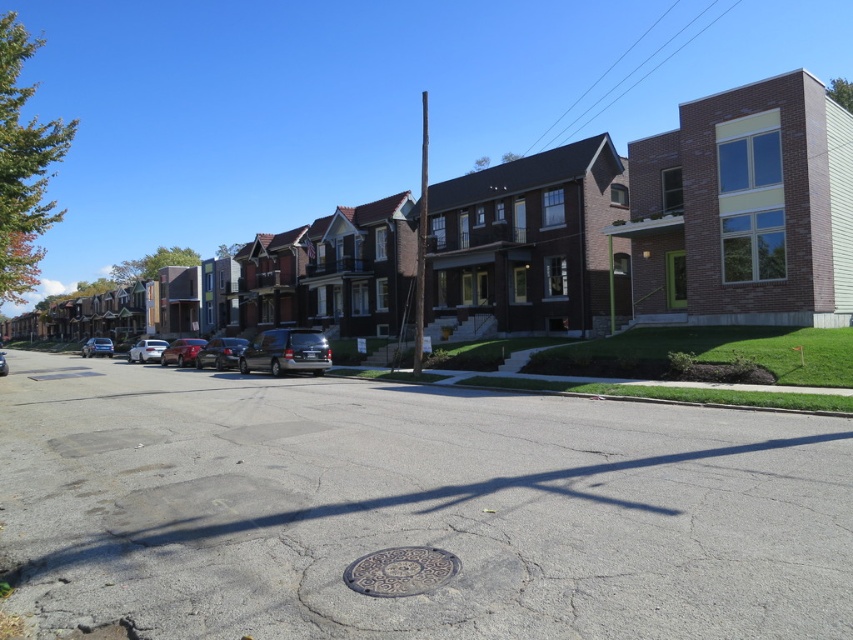
Does gold textured manhole cover at center have a smaller size compared to satin blue sedan at left?

Indeed, gold textured manhole cover at center has a smaller size compared to satin blue sedan at left.

Can you confirm if gold textured manhole cover at center is positioned to the left of satin blue sedan at left?

No, gold textured manhole cover at center is not to the left of satin blue sedan at left.

Is point (442, 554) behind point (106, 342)?

No, it is not.

Where is `gold textured manhole cover at center`? gold textured manhole cover at center is located at coordinates coord(399,570).

Can you confirm if shiny black van at center is positioned below satin blue sedan at left?

Actually, shiny black van at center is above satin blue sedan at left.

Which is in front, point (277, 337) or point (112, 349)?

Positioned in front is point (277, 337).

You are a GUI agent. You are given a task and a screenshot of the screen. Output one action in this format:
    pyautogui.click(x=<x>, y=<y>)
    Task: Click on the shiny black van at center
    
    Given the screenshot: What is the action you would take?
    pyautogui.click(x=286, y=353)

Is satin black sedan at center bigger than metallic silver sedan at center?

Actually, satin black sedan at center might be smaller than metallic silver sedan at center.

You are a GUI agent. You are given a task and a screenshot of the screen. Output one action in this format:
    pyautogui.click(x=<x>, y=<y>)
    Task: Click on the satin black sedan at center
    
    Given the screenshot: What is the action you would take?
    pyautogui.click(x=219, y=353)